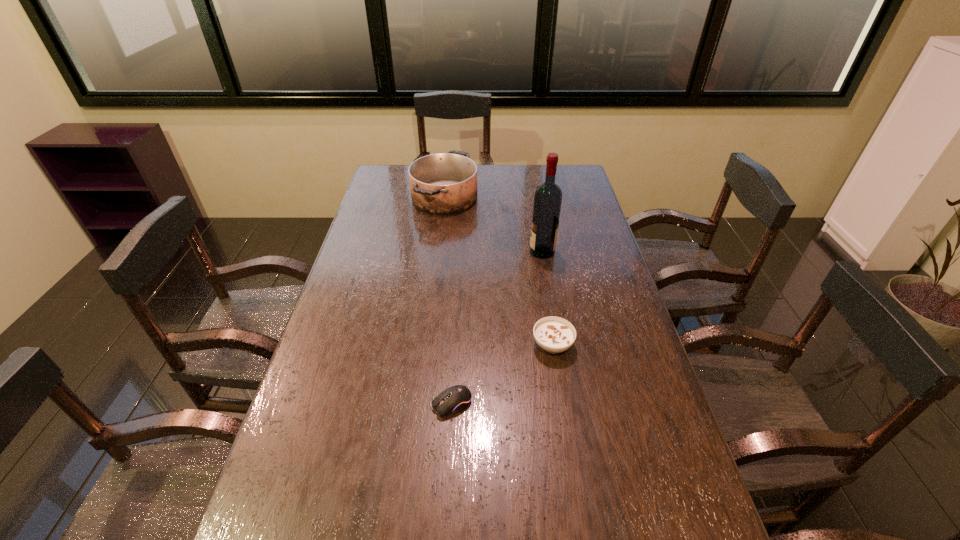
You are a GUI agent. You are given a task and a screenshot of the screen. Output one action in this format:
    pyautogui.click(x=<x>, y=<y>)
    Task: Click on the second farthest object
    
    Given the screenshot: What is the action you would take?
    pyautogui.click(x=548, y=196)

Where is `alcohol`? alcohol is located at coordinates (548, 196).

This screenshot has width=960, height=540. I want to click on the third shortest object, so click(x=445, y=183).

At what (x,y) coordinates should I click in order to perform the action: click on saucepan. Please return your answer as a coordinate pair (x, y). This screenshot has width=960, height=540. Looking at the image, I should click on (445, 183).

At what (x,y) coordinates should I click in order to perform the action: click on soup bowl. Please return your answer as a coordinate pair (x, y). Image resolution: width=960 pixels, height=540 pixels. Looking at the image, I should click on coord(553,334).

Locate an element on the screen. The image size is (960, 540). the second nearest object is located at coordinates (553, 334).

Identify the location of the shortest object. (456, 398).

You are a GUI agent. You are given a task and a screenshot of the screen. Output one action in this format:
    pyautogui.click(x=<x>, y=<y>)
    Task: Click on the nearest object
    
    Given the screenshot: What is the action you would take?
    pyautogui.click(x=456, y=398)

Image resolution: width=960 pixels, height=540 pixels. Find the location of `free space located on the front and back of the third nearest object`. free space located on the front and back of the third nearest object is located at coordinates (503, 252).

Identify the location of vacant region located 0.100m on the front and back of the third nearest object. The height and width of the screenshot is (540, 960). (500, 252).